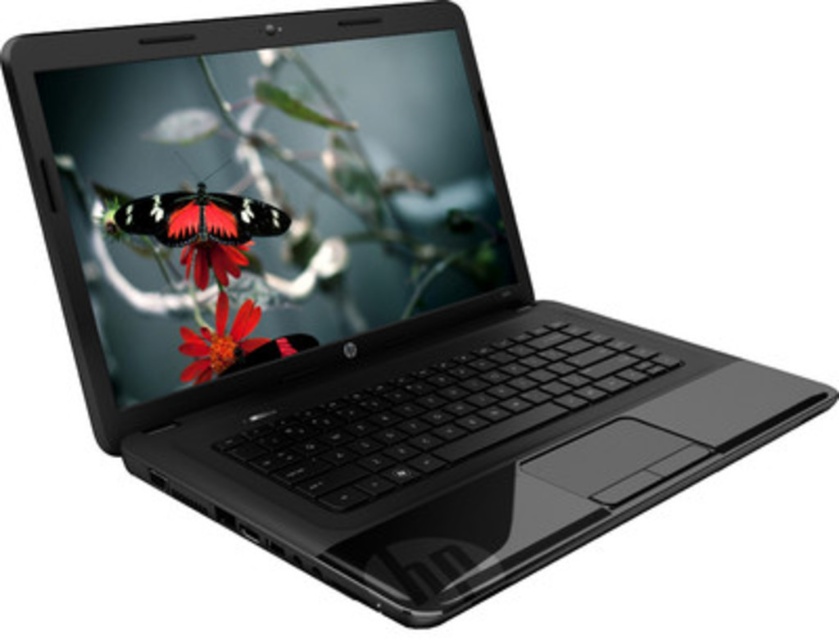
Question: Is glossy plastic screen at center to the left of red matte flower at center from the viewer's perspective?

Choices:
 (A) no
 (B) yes

Answer: (A)

Question: Can you confirm if matte plastic flower at center is bigger than red matte flower at center?

Choices:
 (A) no
 (B) yes

Answer: (B)

Question: Which object is positioned farthest from the matte plastic flower at center?

Choices:
 (A) glossy plastic screen at center
 (B) red matte flower at center

Answer: (A)

Question: Which of these objects is positioned closest to the red matte flower at center?

Choices:
 (A) matte plastic flower at center
 (B) matte black butterfly at center

Answer: (B)

Question: Does glossy plastic screen at center appear on the right side of matte black butterfly at center?

Choices:
 (A) yes
 (B) no

Answer: (A)

Question: Which point is closer to the camera?

Choices:
 (A) (183, 340)
 (B) (232, 264)

Answer: (A)